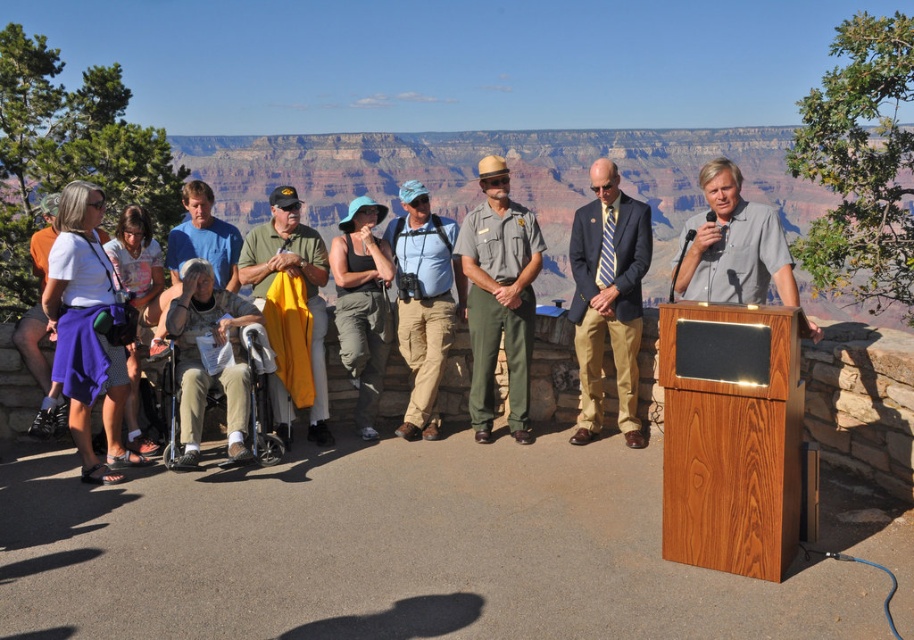
Is point (426, 310) farther from camera compared to point (190, 212)?

No, it is in front of (190, 212).

Does khaki cotton pants at center have a greater height compared to blue cotton shirt at center?

Incorrect, khaki cotton pants at center's height is not larger of blue cotton shirt at center's.

Is point (412, 413) closer to viewer compared to point (176, 257)?

Yes, point (412, 413) is closer to viewer.

The image size is (914, 640). In order to click on khaki cotton pants at center in this screenshot , I will do `click(423, 300)`.

Does point (718, 291) come farther from viewer compared to point (218, 282)?

No.

Image resolution: width=914 pixels, height=640 pixels. Identify the location of gray fabric shirt at center. (732, 244).

You are a GUI agent. You are given a task and a screenshot of the screen. Output one action in this format:
    pyautogui.click(x=<x>, y=<y>)
    Task: Click on the gray fabric shirt at center
    
    Given the screenshot: What is the action you would take?
    pyautogui.click(x=732, y=244)

Is navy blue suit at center bigger than green uniform pants at center?

Correct, navy blue suit at center is larger in size than green uniform pants at center.

Is point (577, 230) positioned behind point (527, 420)?

No, (577, 230) is closer to viewer.

Identify the location of navy blue suit at center. This screenshot has height=640, width=914. (608, 298).